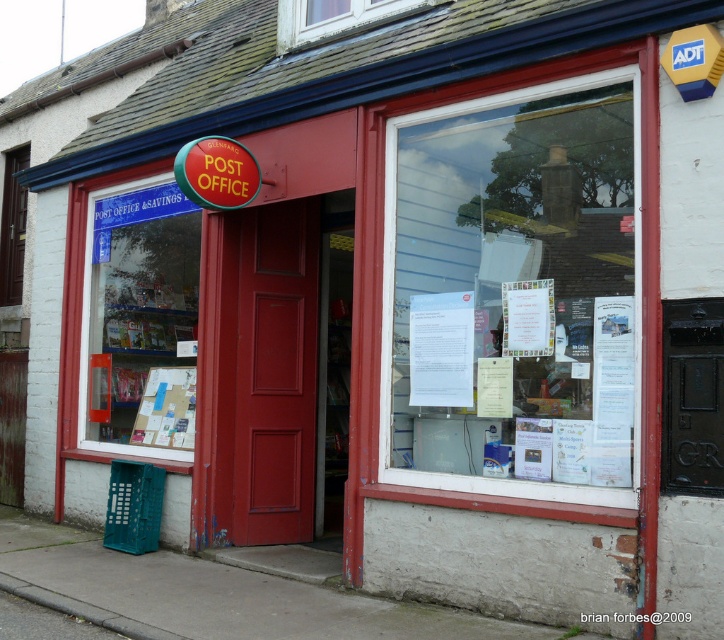
You are a delivery person standing in front of the post office entrance. You need to place a large package on the ground near the entrance. Which object, the gray concrete pavement at lower center or the cardboard bulletin board at center, is more suitable for placing the package?

The gray concrete pavement at lower center is more suitable for placing the large package because it has a larger size compared to the cardboard bulletin board at center.

You are standing in front of the post office and want to check the notices displayed on the transparent glass window at center. Where should you look to find the notices?

The notices are displayed on the transparent glass window at center, which is located at the 2D coordinates point [513,292].